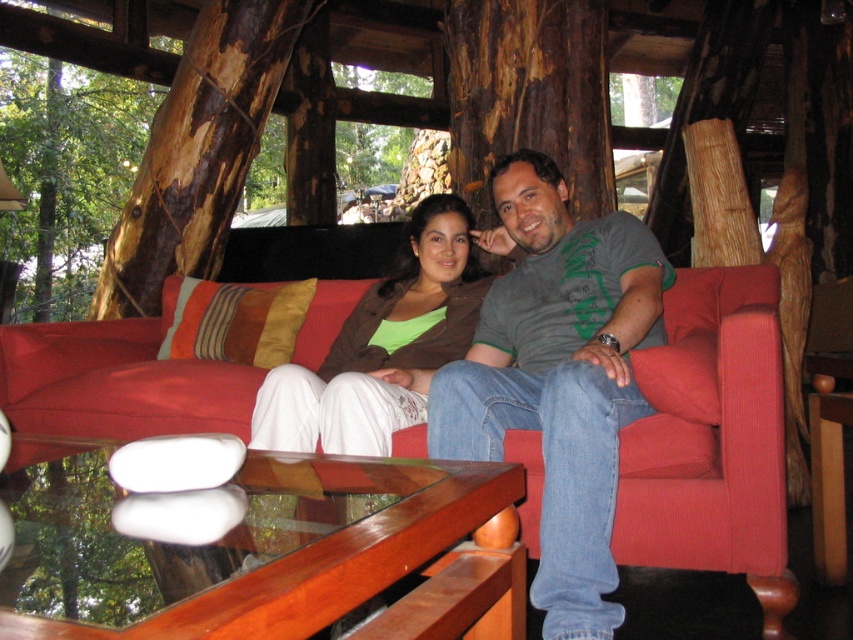
Question: Does corduroy red couch at center appear on the right side of brown rough wood at left?

Choices:
 (A) no
 (B) yes

Answer: (B)

Question: Does corduroy red couch at center appear on the left side of brown rough wood at left?

Choices:
 (A) no
 (B) yes

Answer: (A)

Question: Which point is farther from the camera taking this photo?

Choices:
 (A) (511, 211)
 (B) (39, 83)

Answer: (B)

Question: Is gray-green t-shirt at center above brown rough wood at left?

Choices:
 (A) no
 (B) yes

Answer: (A)

Question: Considering the real-world distances, which object is farthest from the gray-green t-shirt at center?

Choices:
 (A) brown rough wood at left
 (B) matte brown jacket at center
 (C) smooth brown bark at upper left

Answer: (C)

Question: Which object is the closest to the smooth brown bark at upper left?

Choices:
 (A) brown rough wood at left
 (B) corduroy red couch at center
 (C) gray-green t-shirt at center

Answer: (A)